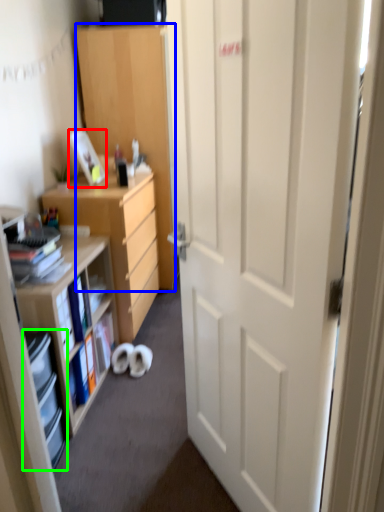
Question: Which object is the farthest from picture frame (highlighted by a red box)? Choose among these: cabinetry (highlighted by a blue box) or shelf (highlighted by a green box).

Choices:
 (A) cabinetry
 (B) shelf

Answer: (B)